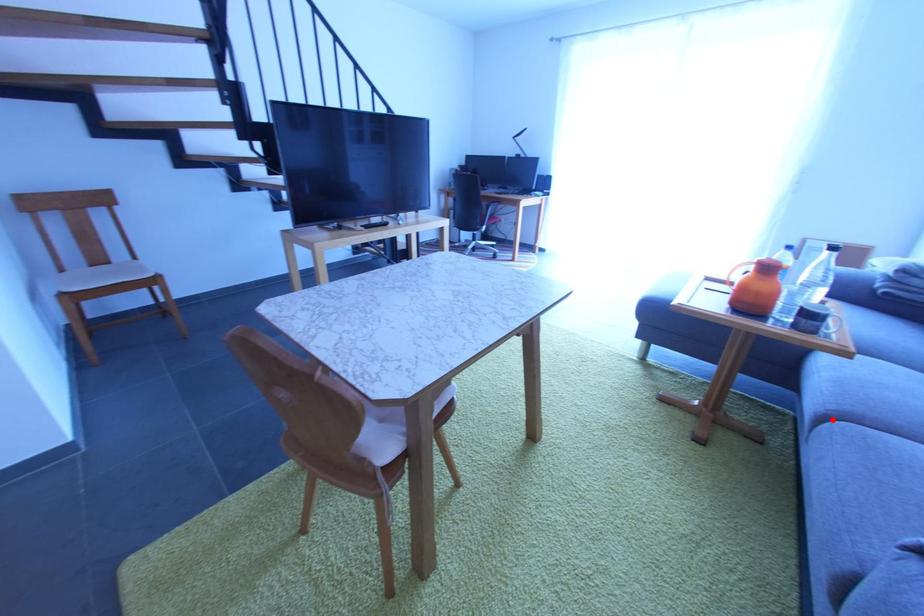
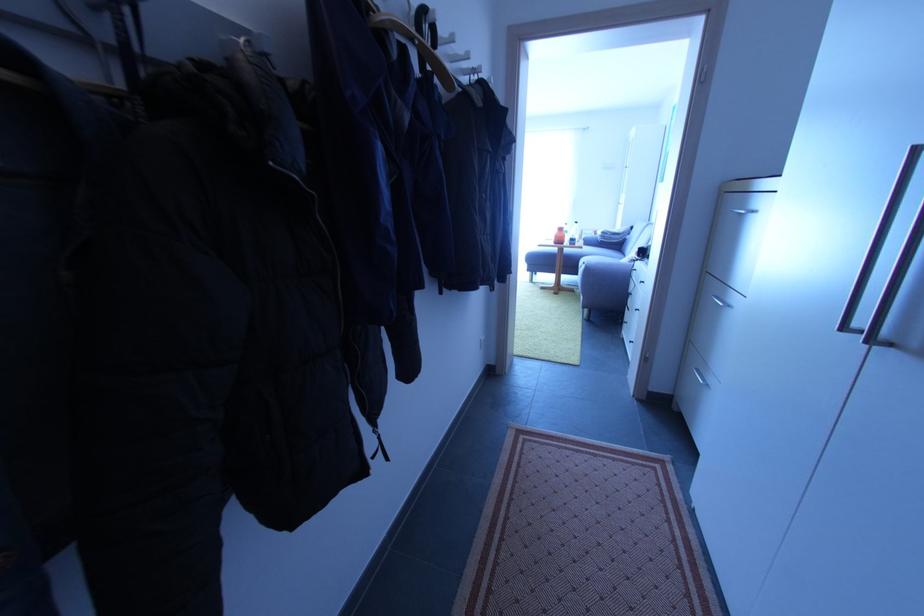
Locate, in the second image, the point that corresponds to the highlighted location in the first image.

(586, 268)